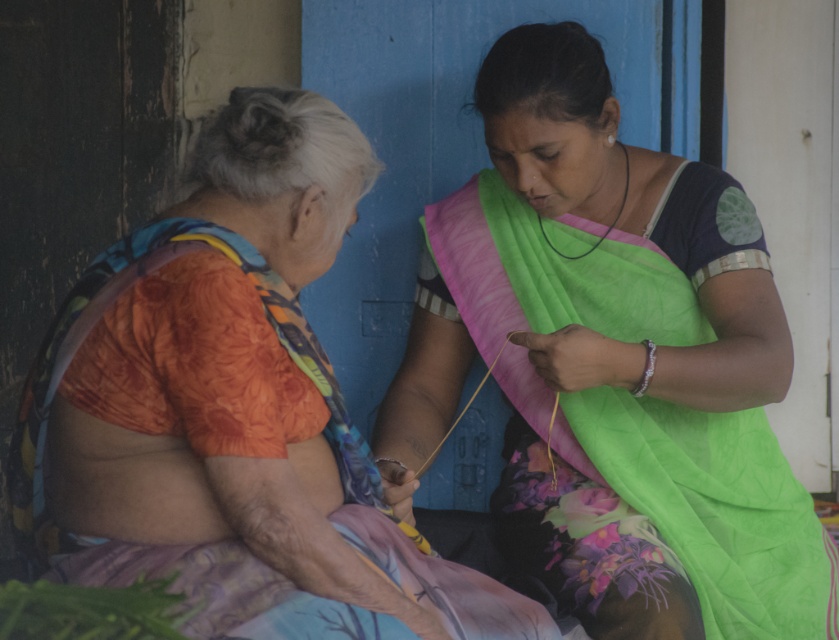
Is green silk saree at center shorter than orange floral blouse at left?

No, green silk saree at center is not shorter than orange floral blouse at left.

Is green silk saree at center wider than orange floral blouse at left?

Indeed, green silk saree at center has a greater width compared to orange floral blouse at left.

You are a GUI agent. You are given a task and a screenshot of the screen. Output one action in this format:
    pyautogui.click(x=<x>, y=<y>)
    Task: Click on the green silk saree at center
    
    Given the screenshot: What is the action you would take?
    pos(613,364)

Find the location of `green silk saree at center`. green silk saree at center is located at coordinates (613, 364).